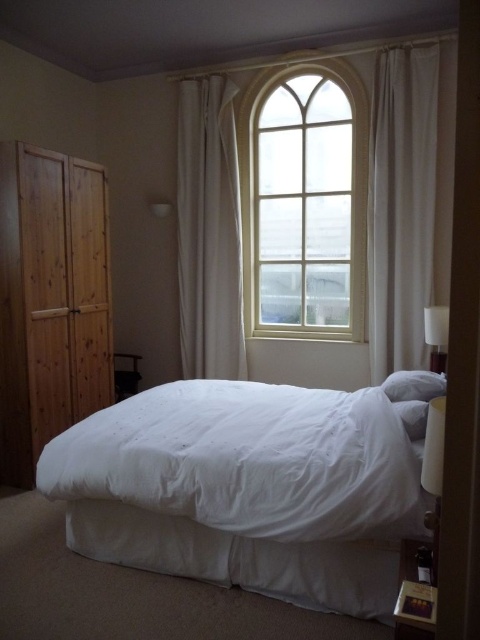
Question: Is white soft bed at center positioned at the back of white fabric curtain at upper center?

Choices:
 (A) no
 (B) yes

Answer: (A)

Question: Is wooden wardrobe at left to the right of white fabric curtain at upper center from the viewer's perspective?

Choices:
 (A) yes
 (B) no

Answer: (B)

Question: Which object is farther from the camera taking this photo?

Choices:
 (A) white wooden window at center
 (B) white soft pillow at right

Answer: (A)

Question: Which point is closer to the camera taking this photo?

Choices:
 (A) (187, 253)
 (B) (31, 372)

Answer: (B)

Question: Which point is farther to the camera?

Choices:
 (A) tap(382, 221)
 (B) tap(292, 96)
 (C) tap(215, 285)
 (D) tap(231, 456)

Answer: (C)

Question: Does white fabric curtain at upper center appear on the right side of white soft pillow at right?

Choices:
 (A) no
 (B) yes

Answer: (A)